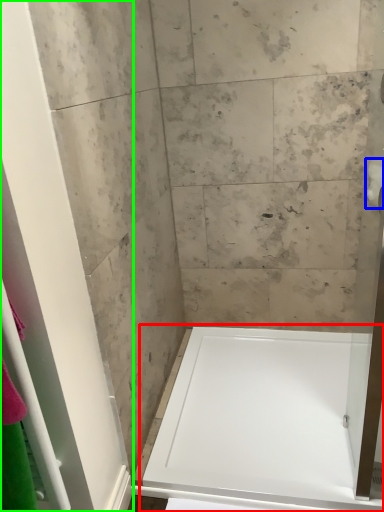
Question: Which object is positioned farthest from bathtub (highlighted by a red box)? Select from toilet paper (highlighted by a blue box) and screen door (highlighted by a green box).

Choices:
 (A) toilet paper
 (B) screen door

Answer: (A)